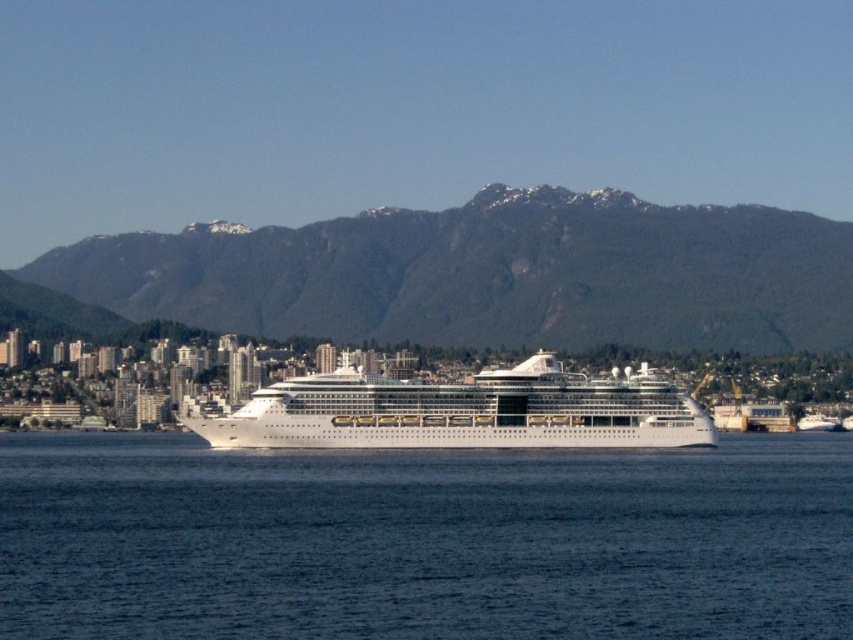
Question: Observing the image, what is the correct spatial positioning of blue water at center in reference to green textured mountain at center?

Choices:
 (A) above
 (B) below

Answer: (B)

Question: Can you confirm if blue water at center is smaller than green textured mountain at center?

Choices:
 (A) no
 (B) yes

Answer: (B)

Question: Among these points, which one is nearest to the camera?

Choices:
 (A) (274, 621)
 (B) (592, 294)

Answer: (A)

Question: Which point is farther to the camera?

Choices:
 (A) green textured mountain at center
 (B) blue water at center
 (C) white glossy cruise ship at center

Answer: (A)

Question: Which object is positioned farthest from the white glossy cruise ship at center?

Choices:
 (A) blue water at center
 (B) green textured mountain at center

Answer: (B)

Question: Does blue water at center appear on the right side of white glossy cruise ship at center?

Choices:
 (A) no
 (B) yes

Answer: (B)